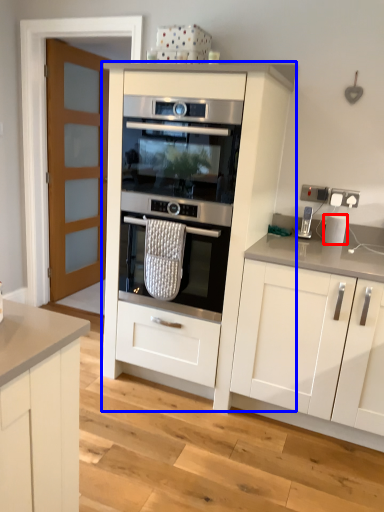
Question: Which object is further to the camera taking this photo, kitchen appliance (highlighted by a red box) or cabinetry (highlighted by a blue box)?

Choices:
 (A) kitchen appliance
 (B) cabinetry

Answer: (A)